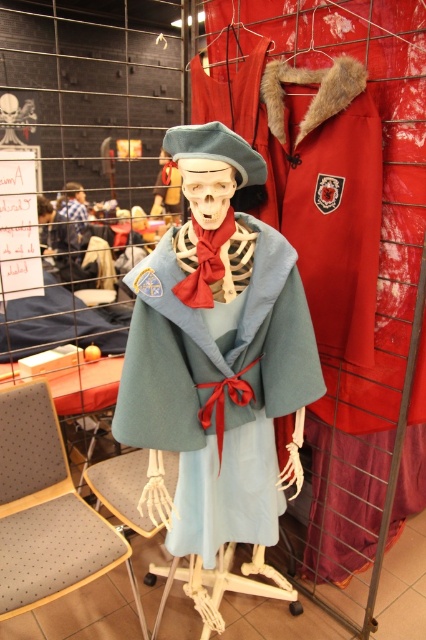
You are organizing a costume party and need to arrange the gray fabric chair at lower left and the blue plaid shirt at center in a small room. Which object should you place first to maximize space efficiency?

The gray fabric chair at lower left should be placed first because it occupies less space than the blue plaid shirt at center, allowing more room for arranging other items.

Based on the scene description, which object is positioned lower between the light blue woolen cape at center and the blue plaid shirt at center?

The light blue woolen cape at center is located below the blue plaid shirt at center, so the light blue woolen cape at center is positioned lower.

You are a costume designer working on a play. You need to arrange two items from the image in a scene where actors will move between them. The items are the light blue woolen cape at center and the blue plaid shirt at center. Given that the actors require at least 10 feet of space to perform a dance routine between these items, will there be enough space?

The distance between the light blue woolen cape at center and the blue plaid shirt at center is 12.43 feet, which exceeds the required 10 feet. Therefore, there is sufficient space for the actors to perform their dance routine between these items.